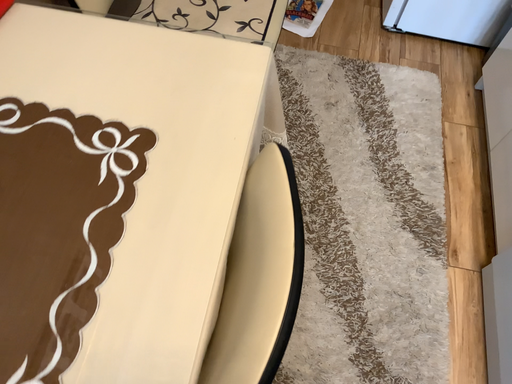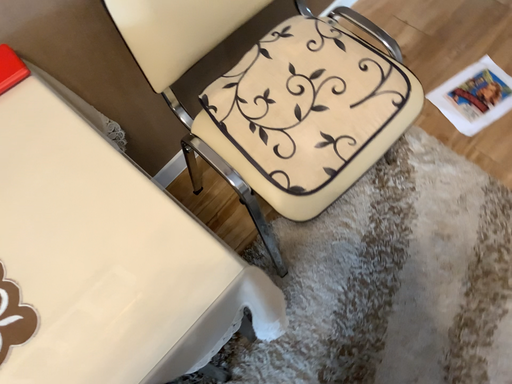
Question: How did the camera likely rotate when shooting the video?

Choices:
 (A) rotated left
 (B) rotated right

Answer: (A)